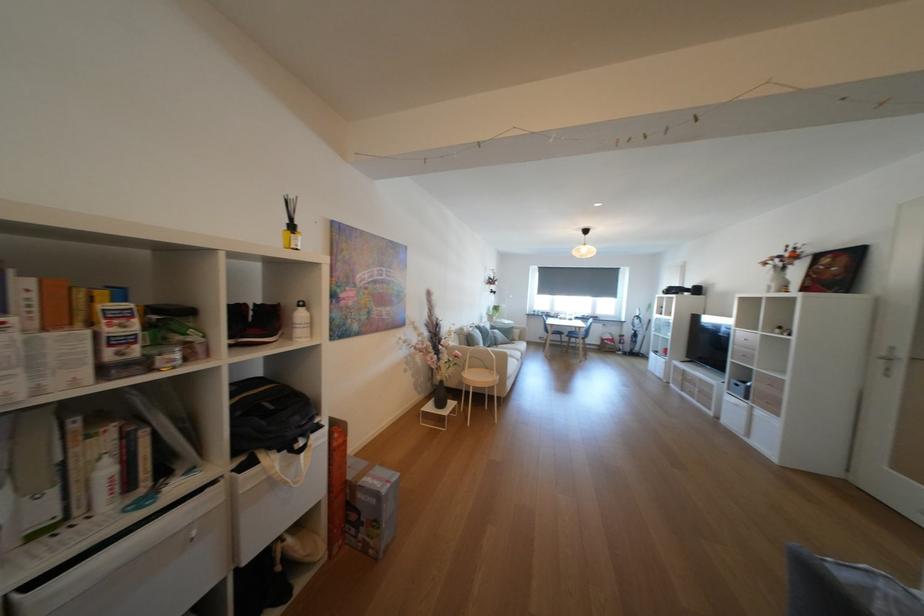
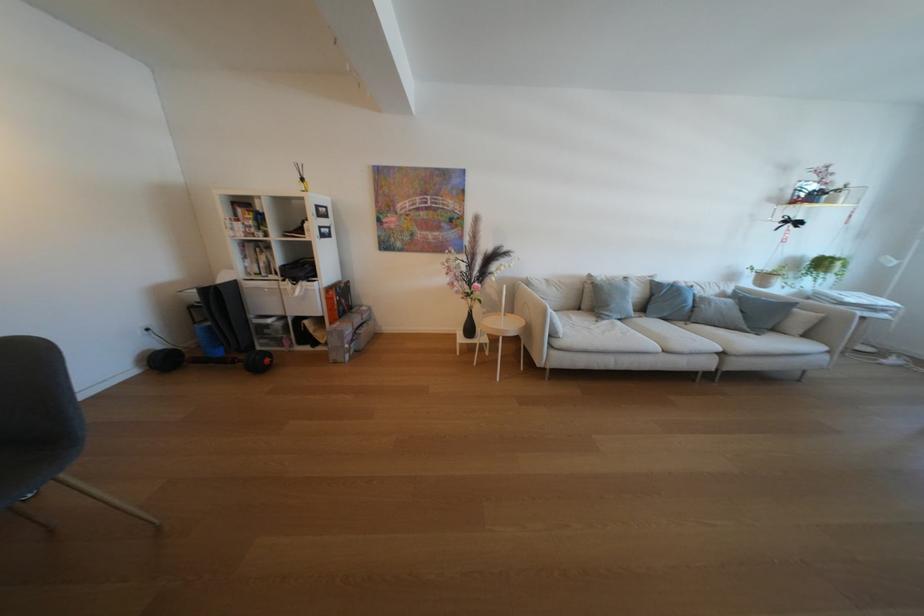
The point at (530,331) is marked in the first image. Where is the corresponding point in the second image?

(833, 315)